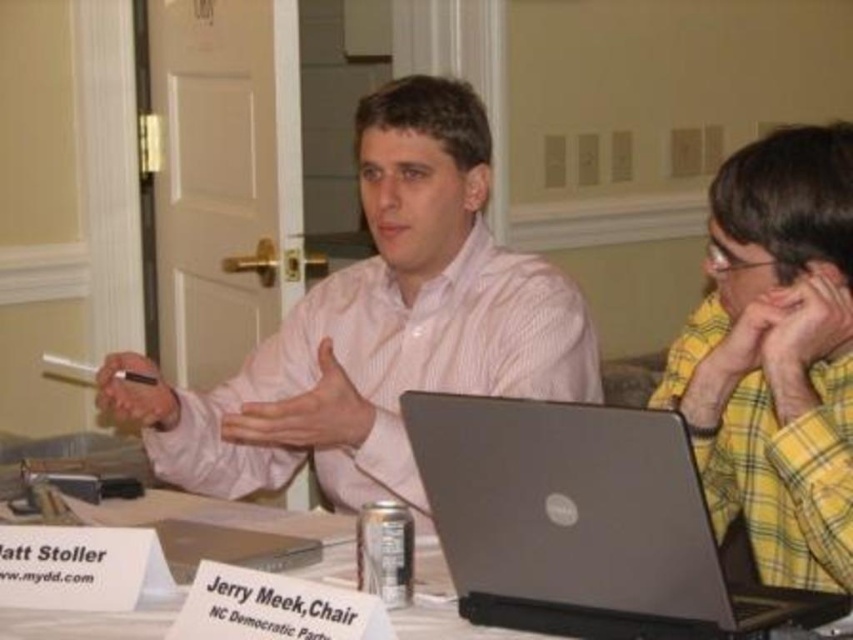
Who is more forward, (538, 435) or (718, 198)?

Positioned in front is point (538, 435).

Can you confirm if silver metallic laptop at center is wider than yellow plaid shirt at right?

Yes, silver metallic laptop at center is wider than yellow plaid shirt at right.

Between point (647, 454) and point (782, 492), which one is positioned behind?

The point (782, 492) is behind.

This screenshot has height=640, width=853. What are the coordinates of `silver metallic laptop at center` in the screenshot? It's located at (x=583, y=524).

Between point (778, 348) and point (190, 502), which one is positioned in front?

Point (778, 348)

At what (x,y) coordinates should I click in order to perform the action: click on yellow plaid shirt at right. Please return your answer as a coordinate pair (x, y). The height and width of the screenshot is (640, 853). Looking at the image, I should click on (776, 355).

Can you confirm if pink striped shirt at center is positioned to the right of yellow plaid shirt at right?

No, pink striped shirt at center is not to the right of yellow plaid shirt at right.

Can you confirm if pink striped shirt at center is positioned above yellow plaid shirt at right?

Indeed, pink striped shirt at center is positioned over yellow plaid shirt at right.

Between point (535, 353) and point (813, 545), which one is positioned behind?

Point (535, 353)

Find the location of a particular element. This screenshot has height=640, width=853. pink striped shirt at center is located at coordinates (378, 326).